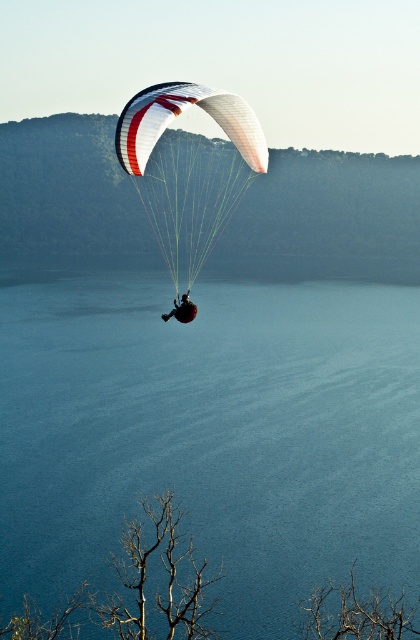
Question: In this image, where is green leafy tree at center located relative to white matte parachute at center?

Choices:
 (A) above
 (B) below

Answer: (A)

Question: Which point is closer to the camera taking this photo?

Choices:
 (A) (319, 476)
 (B) (207, 186)
 (C) (128, 216)

Answer: (A)

Question: Is blue water at center closer to the viewer compared to matte black parachute at center?

Choices:
 (A) no
 (B) yes

Answer: (A)

Question: Which of the following is the farthest from the observer?

Choices:
 (A) green leafy tree at center
 (B) white matte parachute at center
 (C) blue water at center
 (D) matte black parachute at center

Answer: (A)

Question: Among these objects, which one is nearest to the camera?

Choices:
 (A) blue water at center
 (B) white matte parachute at center
 (C) green leafy tree at center

Answer: (B)

Question: From the image, what is the correct spatial relationship of blue water at center in relation to white matte parachute at center?

Choices:
 (A) left
 (B) right

Answer: (B)